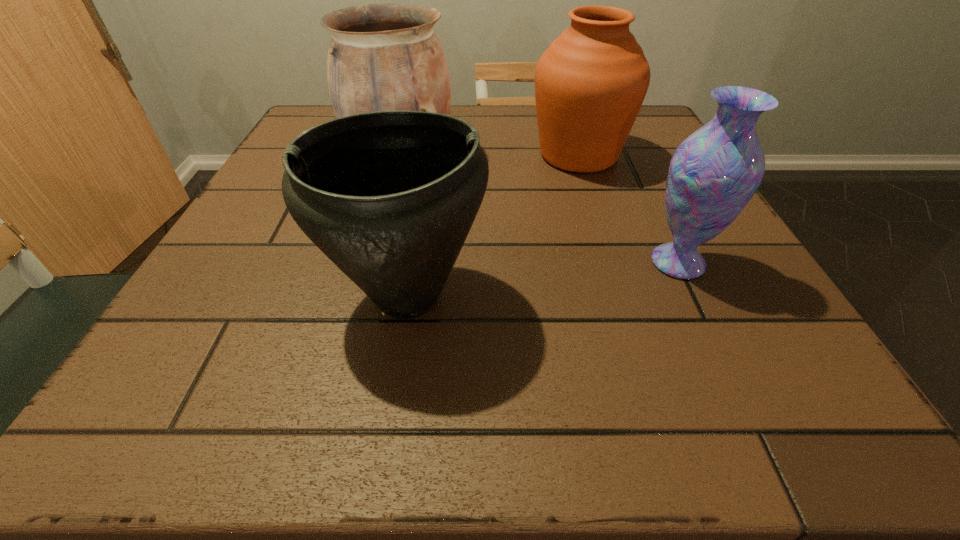
Image resolution: width=960 pixels, height=540 pixels. In order to click on the rightmost urn in this screenshot , I will do `click(590, 83)`.

Where is `vase`? This screenshot has width=960, height=540. vase is located at coordinates click(x=713, y=174).

Locate an element on the screen. The width and height of the screenshot is (960, 540). the nearest urn is located at coordinates (389, 197).

I want to click on vacant space situated on the front of the rightmost urn, so click(607, 244).

The height and width of the screenshot is (540, 960). I want to click on vacant space located on the back of the vase, so click(623, 147).

This screenshot has width=960, height=540. Identify the location of free space located on the left of the nearest urn. (279, 296).

Locate an element on the screen. This screenshot has width=960, height=540. object located at the left edge is located at coordinates (382, 57).

This screenshot has width=960, height=540. In order to click on urn present at the right edge in this screenshot , I will do `click(590, 83)`.

I want to click on vase present at the right edge, so click(x=713, y=174).

Find the location of `object situated at the far left corner`. object situated at the far left corner is located at coordinates (382, 57).